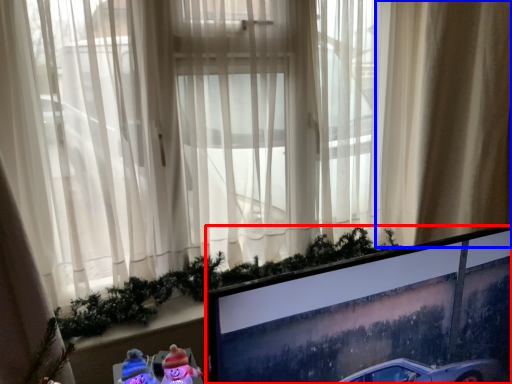
Question: Which object appears farthest to the camera in this image, computer monitor (highlighted by a red box) or curtain (highlighted by a blue box)?

Choices:
 (A) computer monitor
 (B) curtain

Answer: (B)